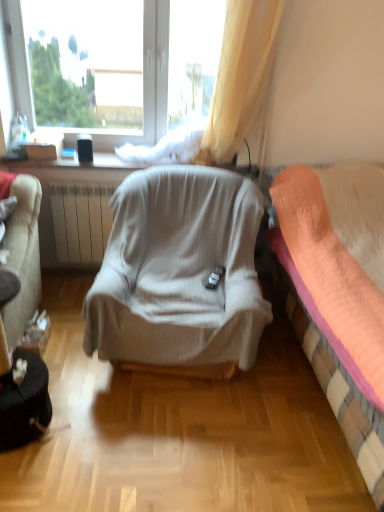
Question: Considering the relative positions of transparent plastic window at upper center and light gray fabric chair at center in the image provided, is transparent plastic window at upper center to the right of light gray fabric chair at center from the viewer's perspective?

Choices:
 (A) no
 (B) yes

Answer: (A)

Question: From a real-world perspective, is transparent plastic window at upper center under light gray fabric chair at center?

Choices:
 (A) no
 (B) yes

Answer: (A)

Question: Is transparent plastic window at upper center taller than light gray fabric chair at center?

Choices:
 (A) no
 (B) yes

Answer: (B)

Question: Considering the relative positions of transparent plastic window at upper center and light gray fabric chair at center in the image provided, is transparent plastic window at upper center behind light gray fabric chair at center?

Choices:
 (A) no
 (B) yes

Answer: (B)

Question: Is transparent plastic window at upper center next to light gray fabric chair at center?

Choices:
 (A) yes
 (B) no

Answer: (B)

Question: From a real-world perspective, is orange fabric bed at right positioned above or below light gray fabric chair at center?

Choices:
 (A) above
 (B) below

Answer: (A)

Question: Is orange fabric bed at right to the left or to the right of light gray fabric chair at center in the image?

Choices:
 (A) left
 (B) right

Answer: (B)

Question: Is orange fabric bed at right taller or shorter than light gray fabric chair at center?

Choices:
 (A) tall
 (B) short

Answer: (A)

Question: Is point (304, 290) closer or farther from the camera than point (206, 244)?

Choices:
 (A) closer
 (B) farther

Answer: (A)

Question: Visually, is transparent plastic window at upper center positioned to the left or to the right of orange fabric bed at right?

Choices:
 (A) left
 (B) right

Answer: (A)

Question: In the image, is transparent plastic window at upper center positioned in front of or behind orange fabric bed at right?

Choices:
 (A) front
 (B) behind

Answer: (B)

Question: In terms of height, does transparent plastic window at upper center look taller or shorter compared to orange fabric bed at right?

Choices:
 (A) tall
 (B) short

Answer: (B)

Question: Is transparent plastic window at upper center spatially inside orange fabric bed at right, or outside of it?

Choices:
 (A) inside
 (B) outside

Answer: (B)

Question: From their relative heights in the image, would you say orange fabric bed at right is taller or shorter than transparent plastic window at upper center?

Choices:
 (A) short
 (B) tall

Answer: (B)

Question: From the image's perspective, is orange fabric bed at right above or below transparent plastic window at upper center?

Choices:
 (A) above
 (B) below

Answer: (B)